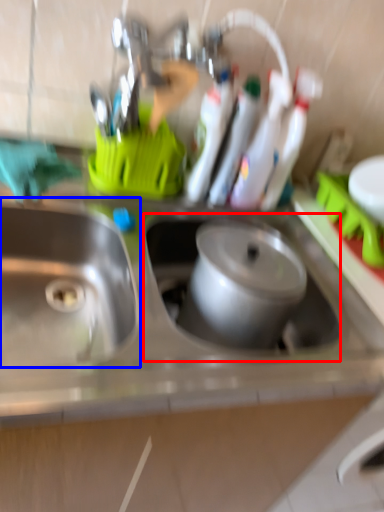
Question: Which of the following is the closest to the observer, sink (highlighted by a red box) or sink (highlighted by a blue box)?

Choices:
 (A) sink
 (B) sink

Answer: (B)